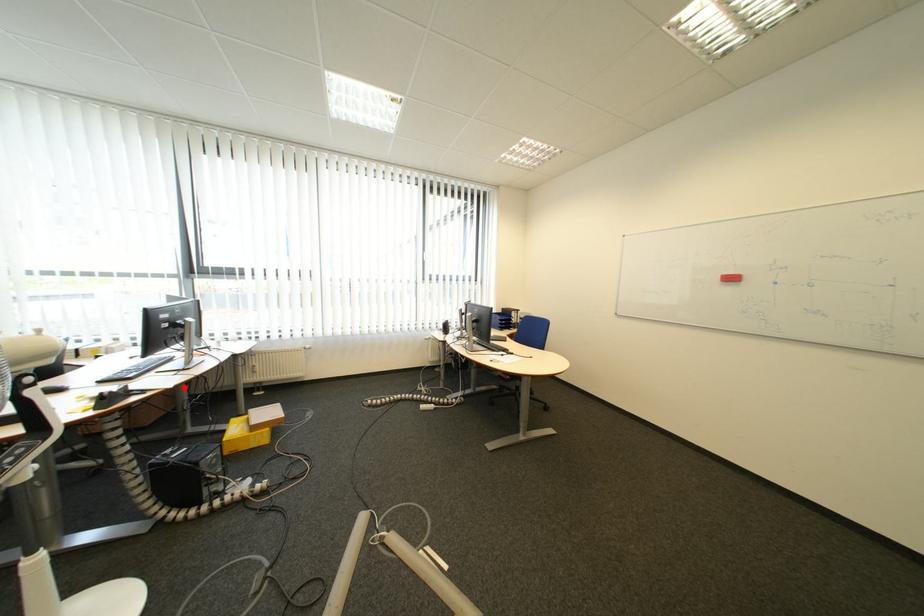
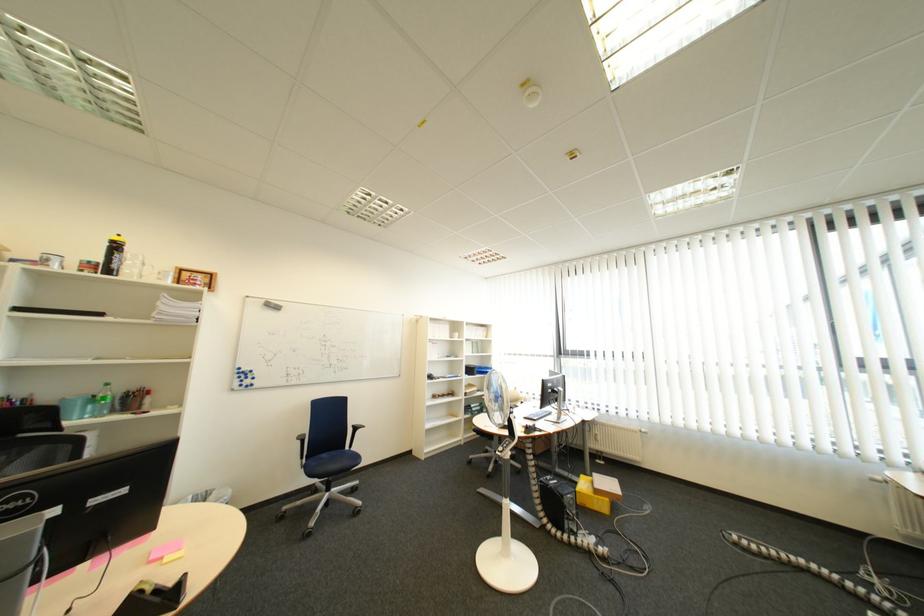
Question: I am providing you with two images of the same scene from different viewpoints. Given a red point in image1, look at the same physical point in image2. Is it:

Choices:
 (A) Closer to the viewpoint
 (B) Farther from the viewpoint

Answer: (B)